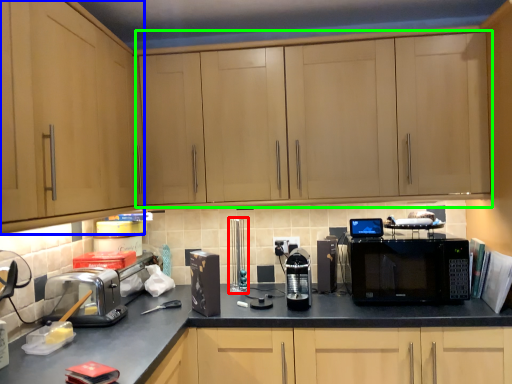
Question: Which object is positioned closest to appliance (highlighted by a red box)? Select from cabinetry (highlighted by a blue box) and cabinetry (highlighted by a green box).

Choices:
 (A) cabinetry
 (B) cabinetry

Answer: (B)